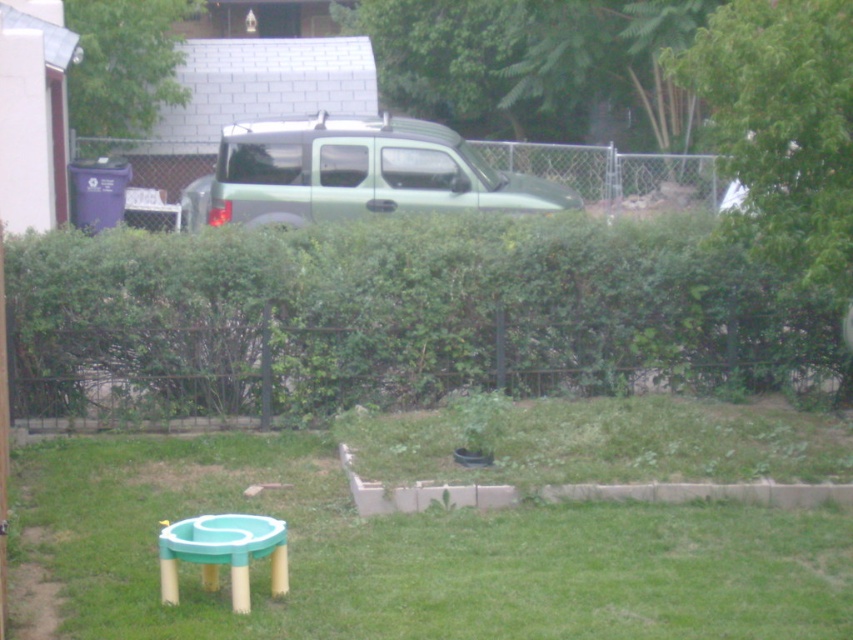
You are a child playing in the backyard and want to reach the teal plastic stool at lower left from where you are standing on the green grass at lower center. Which direction should you move to get closer to the stool?

Since the green grass at lower center is closer to the viewer than the teal plastic stool at lower left, you should move backward to get closer to the teal plastic stool at lower left.

You are a gardener who wants to place a new plant pot between the green leafy bush at upper center and the teal plastic stool at lower left. Considering their heights, which object should the pot be placed closer to in order to avoid blocking sunlight to the shorter one?

The teal plastic stool at lower left is shorter than the green leafy bush at upper center. To avoid blocking sunlight to the shorter object, the plant pot should be placed closer to the teal plastic stool at lower left.